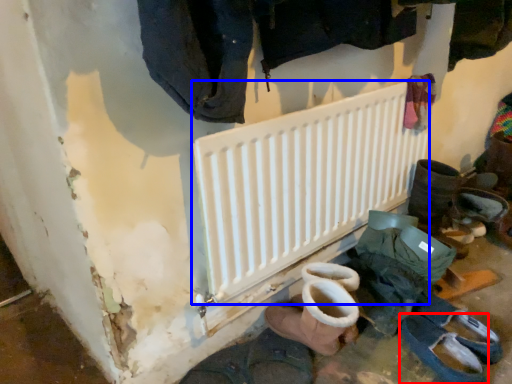
Question: Among these objects, which one is nearest to the camera, footwear (highlighted by a red box) or radiator (highlighted by a blue box)?

Choices:
 (A) footwear
 (B) radiator

Answer: (B)